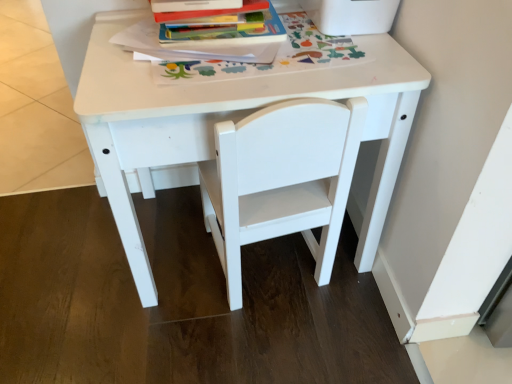
Locate an element on the screen. The width and height of the screenshot is (512, 384). free space in front of white matte table at center is located at coordinates (252, 343).